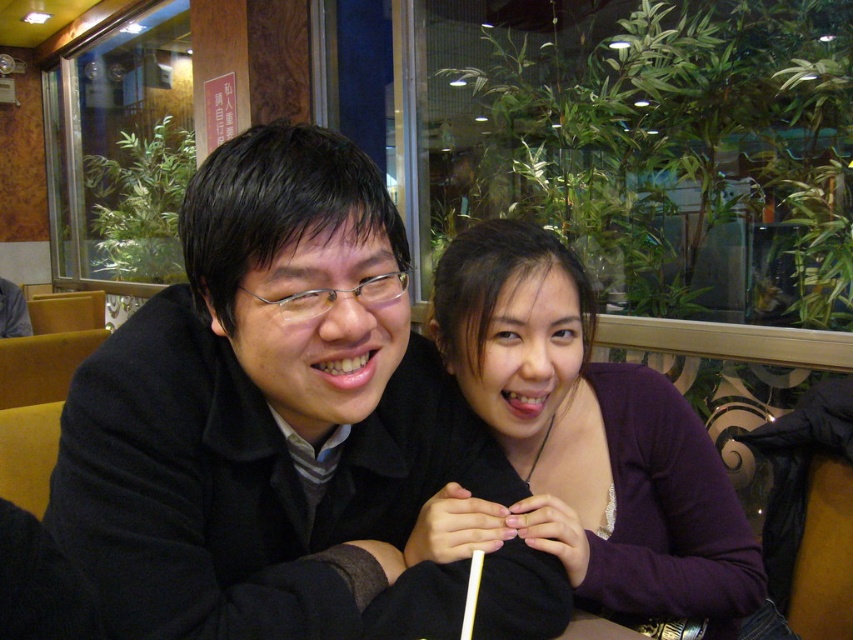
You are a photographer trying to capture a closeup shot of the person on the left. You notice two points in the image labeled as point (x=151, y=497) and point (x=509, y=237). Which point should you focus on to ensure the person on the left is in sharp focus?

You should focus on point (x=151, y=497) because it is closer to the camera than point (x=509, y=237), ensuring the person on the left is in sharp focus.

You are a photographer trying to capture a group photo of the black matte jacket at center and the purple matte sweater at center. Since you want them to appear side by side in the photo, which one should be placed to the left to match their current positions?

The black matte jacket at center should be placed to the left because it is already positioned on the left side of the purple matte sweater at center in the current scene.